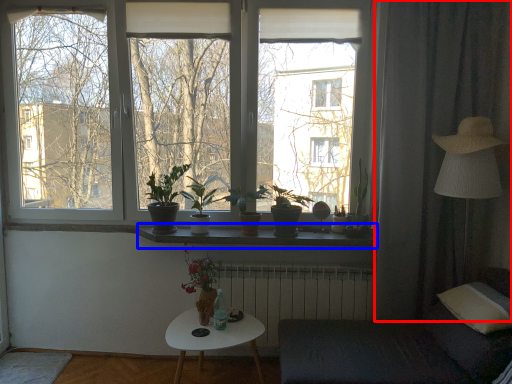
Question: Which object is further to the camera taking this photo, curtain (highlighted by a red box) or window sill (highlighted by a blue box)?

Choices:
 (A) curtain
 (B) window sill

Answer: (B)